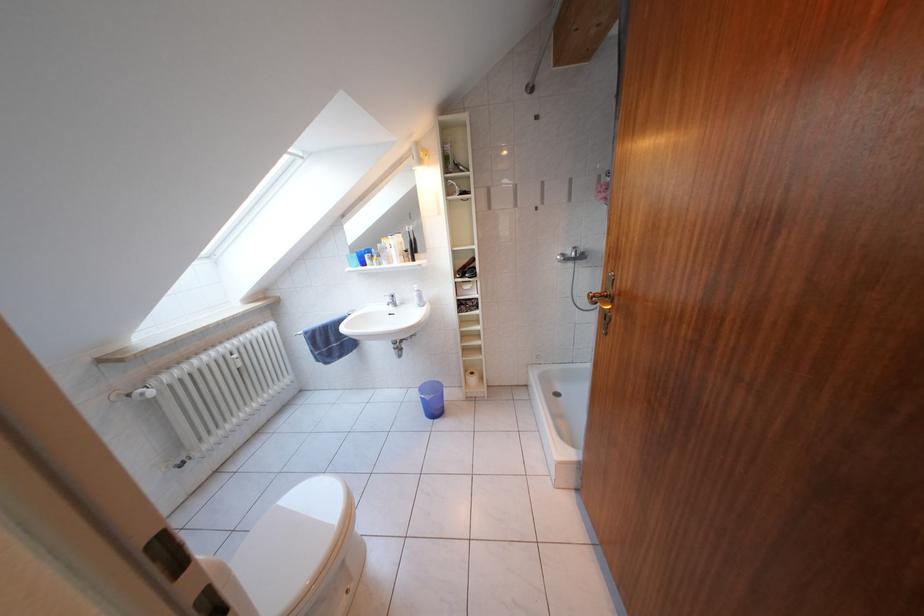
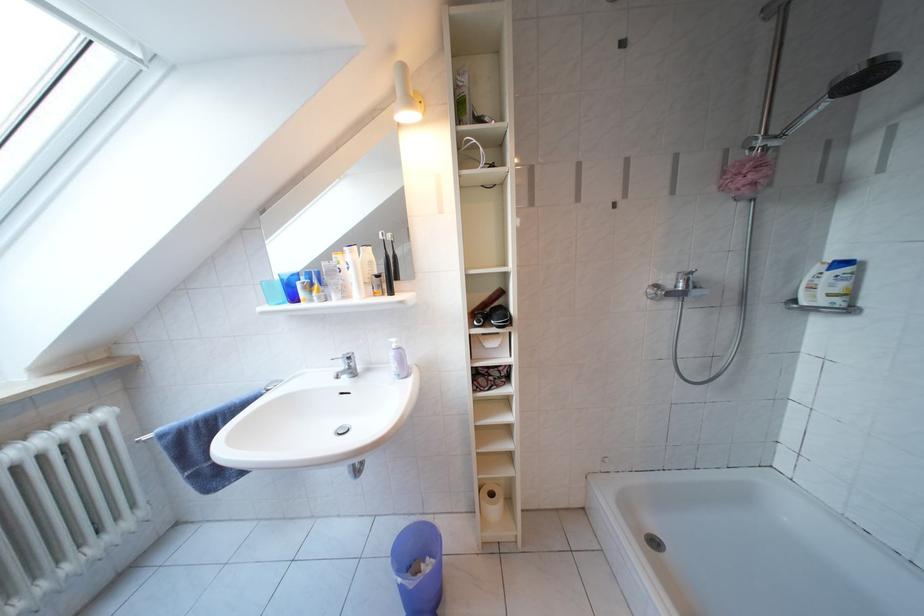
Locate, in the second image, the point that corresponds to (480,379) in the first image.

(500, 499)